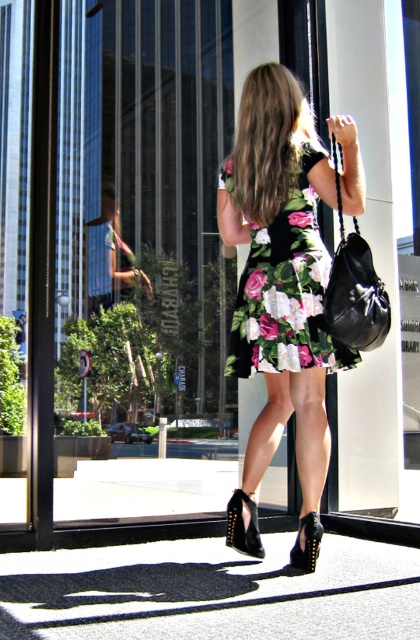
Question: Is transparent glass door at center behind black studded leather sandal at lower center?

Choices:
 (A) no
 (B) yes

Answer: (B)

Question: Which object is closer to the camera taking this photo?

Choices:
 (A) black studded sandal at lower center
 (B) floral dress at center
 (C) transparent glass door at center

Answer: (B)

Question: Is the position of transparent glass door at center more distant than that of black studded leather sandal at lower center?

Choices:
 (A) no
 (B) yes

Answer: (B)

Question: Does floral dress at center have a smaller size compared to black studded leather sandal at lower center?

Choices:
 (A) no
 (B) yes

Answer: (A)

Question: Which point is farther to the camera?

Choices:
 (A) click(x=359, y=177)
 (B) click(x=370, y=305)
 (C) click(x=238, y=547)
 (D) click(x=102, y=406)

Answer: (D)

Question: Estimate the real-world distances between objects in this image. Which object is farther from the floral dress at center?

Choices:
 (A) black studded leather sandal at lower center
 (B) black leather handbag at right

Answer: (A)